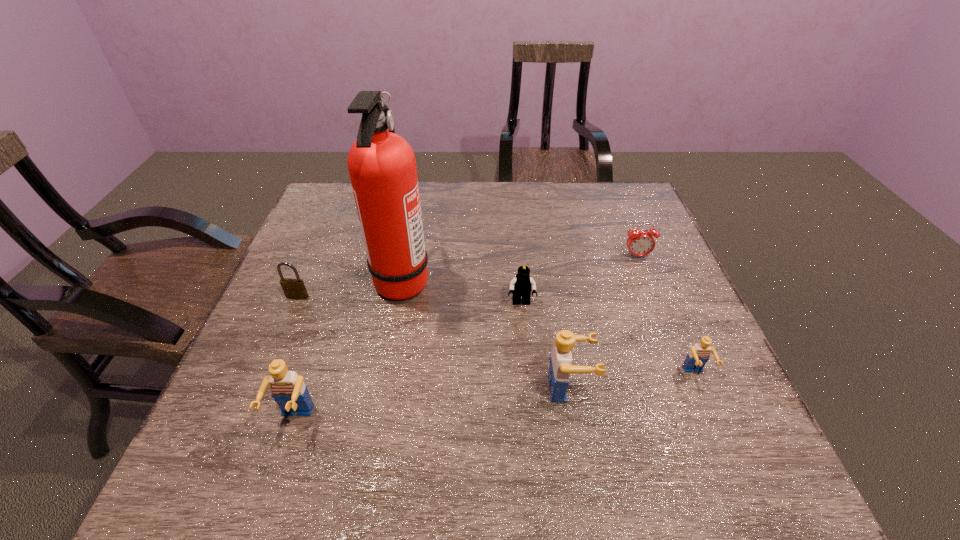
In order to click on blank region between the padlock and the third Lego from left to right in this screenshot , I will do `click(433, 342)`.

The width and height of the screenshot is (960, 540). In order to click on free space between the padlock and the alarm clock in this screenshot , I will do `click(468, 276)`.

This screenshot has height=540, width=960. What are the coordinates of `unoccupied area between the fifth object from right to left and the leftmost object` in the screenshot? It's located at (349, 288).

The image size is (960, 540). In order to click on free space that is in between the second Lego from right to left and the alarm clock in this screenshot , I will do `click(603, 322)`.

Find the location of `vacant space that is in between the fire extinguisher and the rightmost Lego`. vacant space that is in between the fire extinguisher and the rightmost Lego is located at coordinates click(x=548, y=327).

Identify which object is the fourth closest to the third tallest object. Please provide its 2D coordinates. Your answer should be formatted as a tuple, i.e. [(x, y)], where the tuple contains the x and y coordinates of a point satisfying the conditions above.

[(522, 285)]

The width and height of the screenshot is (960, 540). Identify the location of object that stands as the third closest to the third object from left to right. (287, 388).

Select which Lego appears as the second closest to the third tallest object. Please provide its 2D coordinates. Your answer should be formatted as a tuple, i.e. [(x, y)], where the tuple contains the x and y coordinates of a point satisfying the conditions above.

[(522, 285)]

Locate which Lego is the third closest to the leftmost object. Please provide its 2D coordinates. Your answer should be formatted as a tuple, i.e. [(x, y)], where the tuple contains the x and y coordinates of a point satisfying the conditions above.

[(560, 360)]

Find the location of a particular element. free space in the image that satisfies the following two spatial constraints: 1. on the face of the fifth object from left to right; 2. on the face of the sixth object from right to left is located at coordinates (574, 420).